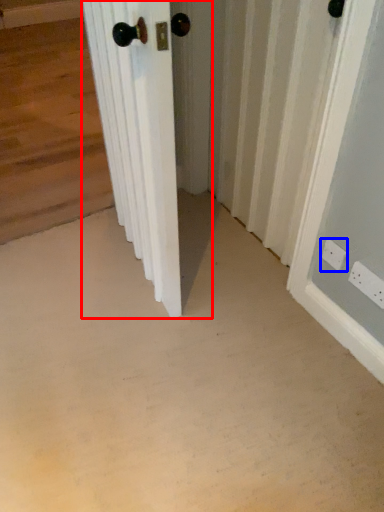
Question: Which of the following is the farthest to the observer, door (highlighted by a red box) or electric outlet (highlighted by a blue box)?

Choices:
 (A) door
 (B) electric outlet

Answer: (B)